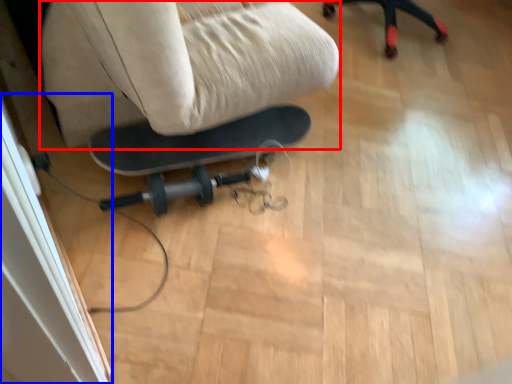
Question: Which of the following is the farthest to the observer, swivel chair (highlighted by a red box) or screen door (highlighted by a blue box)?

Choices:
 (A) swivel chair
 (B) screen door

Answer: (B)